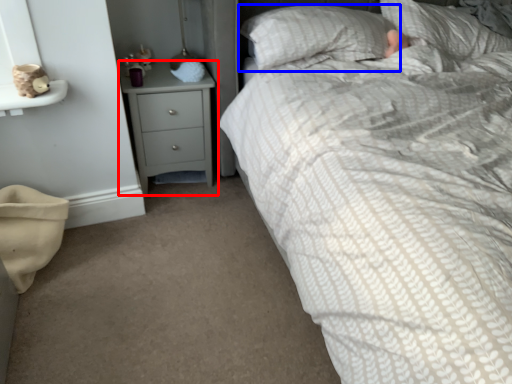
Question: Which of the following is the closest to the observer, chest of drawers (highlighted by a red box) or pillow (highlighted by a blue box)?

Choices:
 (A) chest of drawers
 (B) pillow

Answer: (B)